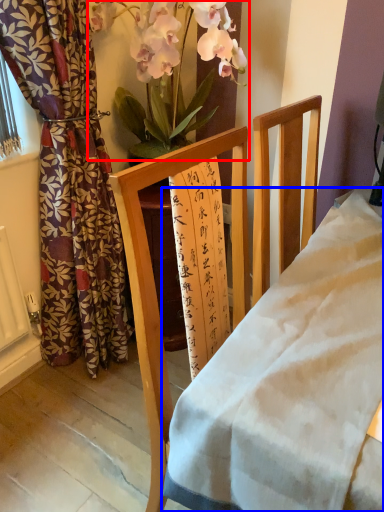
Question: Which point is further to the camera, floral arrangement (highlighted by a red box) or desk (highlighted by a blue box)?

Choices:
 (A) floral arrangement
 (B) desk

Answer: (A)